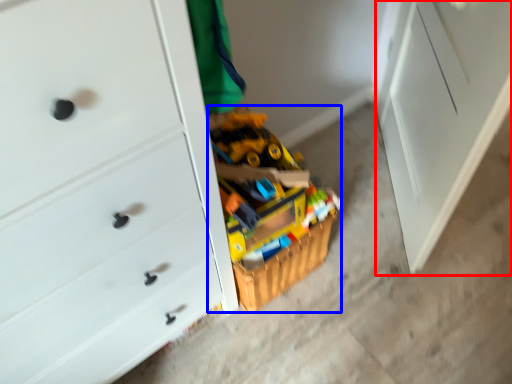
Question: Which object appears farthest to the camera in this image, file cabinet (highlighted by a red box) or toy (highlighted by a blue box)?

Choices:
 (A) file cabinet
 (B) toy

Answer: (B)